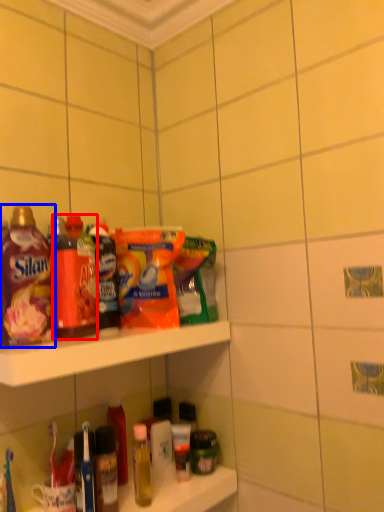
Question: Which point is closer to the camera, bottle (highlighted by a red box) or bottle (highlighted by a blue box)?

Choices:
 (A) bottle
 (B) bottle

Answer: (B)